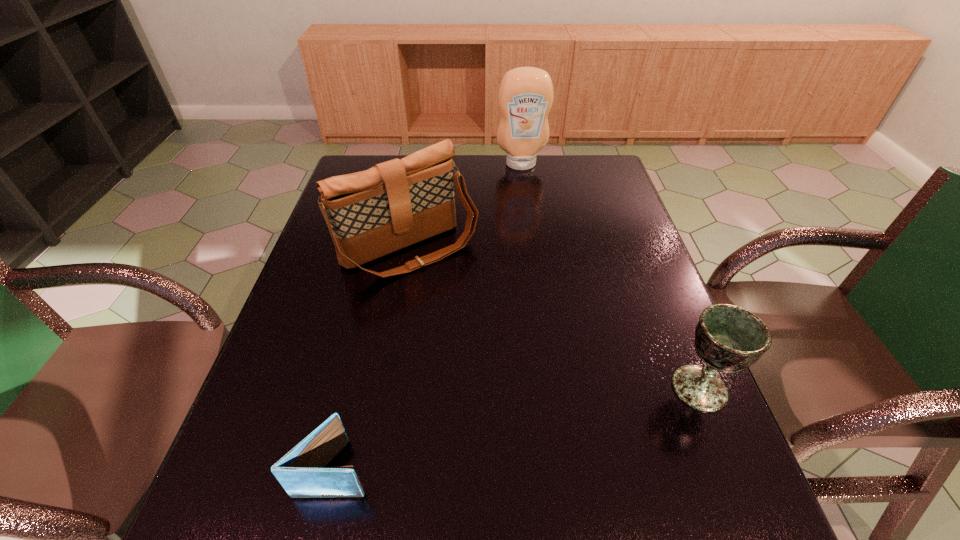
The width and height of the screenshot is (960, 540). In order to click on free space between the chalice and the tallest object in this screenshot , I will do (x=611, y=276).

You are a GUI agent. You are given a task and a screenshot of the screen. Output one action in this format:
    pyautogui.click(x=<x>, y=<y>)
    Task: Click on the free spot between the second shortest object and the farthest object
    This screenshot has height=540, width=960.
    Given the screenshot: What is the action you would take?
    pyautogui.click(x=611, y=276)

I want to click on blank region between the nearest object and the rightmost object, so click(516, 428).

The width and height of the screenshot is (960, 540). In order to click on free space between the farthest object and the wallet in this screenshot , I will do `click(428, 316)`.

This screenshot has width=960, height=540. In order to click on vacant region between the nearest object and the third object from left to right in this screenshot , I will do `click(428, 316)`.

I want to click on free space that is in between the shortest object and the second tallest object, so pyautogui.click(x=372, y=359).

I want to click on free space that is in between the nearest object and the tallest object, so click(428, 316).

Find the location of `object that ranks as the second closest to the third tallest object`. object that ranks as the second closest to the third tallest object is located at coordinates (301, 472).

Point out which object is positioned as the third nearest to the second tallest object. Please provide its 2D coordinates. Your answer should be formatted as a tuple, i.e. [(x, y)], where the tuple contains the x and y coordinates of a point satisfying the conditions above.

[(728, 338)]

Locate an element on the screen. The height and width of the screenshot is (540, 960). free location that satisfies the following two spatial constraints: 1. on the front side of the shoulder bag; 2. on the right side of the third tallest object is located at coordinates (386, 388).